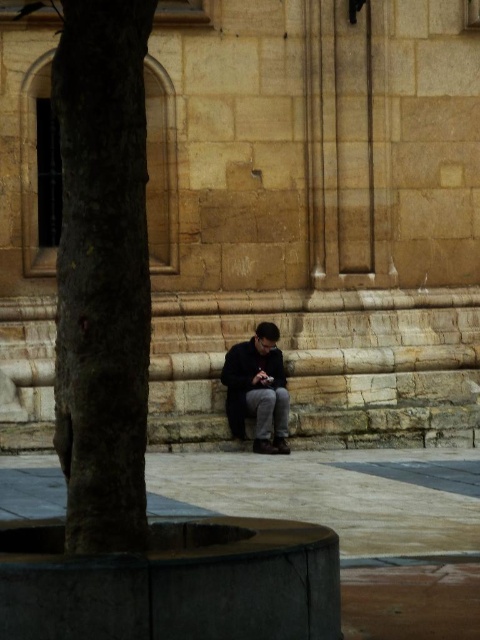
Question: Does smooth brown tree trunk at left appear on the left side of dark gray fabric jacket at center?

Choices:
 (A) yes
 (B) no

Answer: (A)

Question: Which of the following is the farthest from the observer?

Choices:
 (A) dark gray fabric jacket at center
 (B) smooth brown tree trunk at left

Answer: (A)

Question: Is smooth brown tree trunk at left to the left of dark gray fabric jacket at center from the viewer's perspective?

Choices:
 (A) no
 (B) yes

Answer: (B)

Question: Among these points, which one is nearest to the camera?

Choices:
 (A) (238, 360)
 (B) (111, 515)

Answer: (B)

Question: Observing the image, what is the correct spatial positioning of smooth brown tree trunk at left in reference to dark gray fabric jacket at center?

Choices:
 (A) below
 (B) above

Answer: (B)